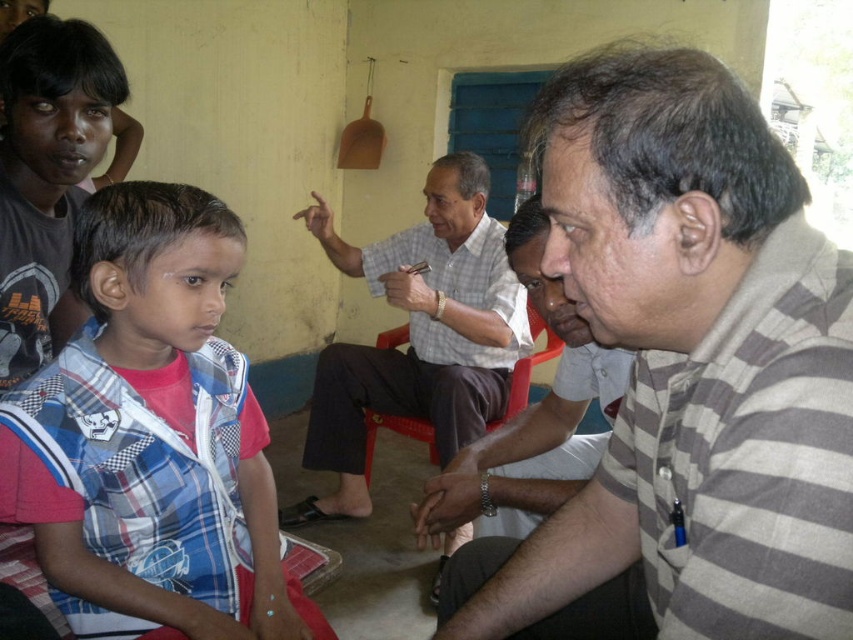
The width and height of the screenshot is (853, 640). What do you see at coordinates (685, 376) in the screenshot?
I see `gray striped shirt at center` at bounding box center [685, 376].

Who is more forward, (479,596) or (451,406)?

Positioned in front is point (479,596).

Where is `gray striped shirt at center`? gray striped shirt at center is located at coordinates (685, 376).

Is plaid fabric shirt at left above striped cotton shirt at center?

Yes.

Is plaid fabric shirt at left further to camera compared to striped cotton shirt at center?

That is False.

Which is in front, point (3, 433) or point (480, 484)?

Point (3, 433) is more forward.

Identify the location of plaid fabric shirt at left. (151, 436).

Between point (849, 566) and point (607, 381), which one is positioned behind?

The point (607, 381) is more distant.

Is gray striped shirt at center to the right of striped cotton shirt at center from the viewer's perspective?

No, gray striped shirt at center is not to the right of striped cotton shirt at center.

Is point (782, 509) positioned in front of point (590, 378)?

Yes, it is.

Where is `gray striped shirt at center`? gray striped shirt at center is located at coordinates (685, 376).